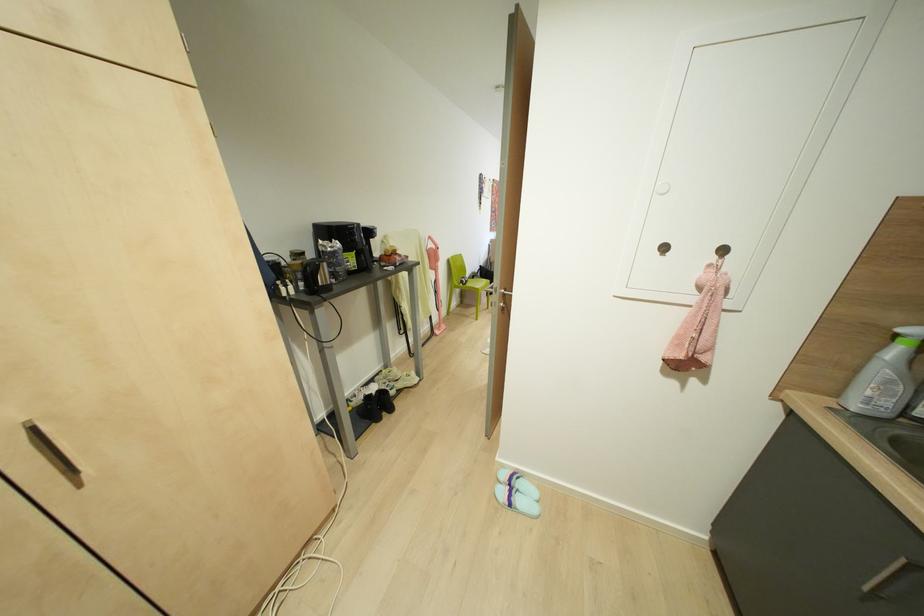
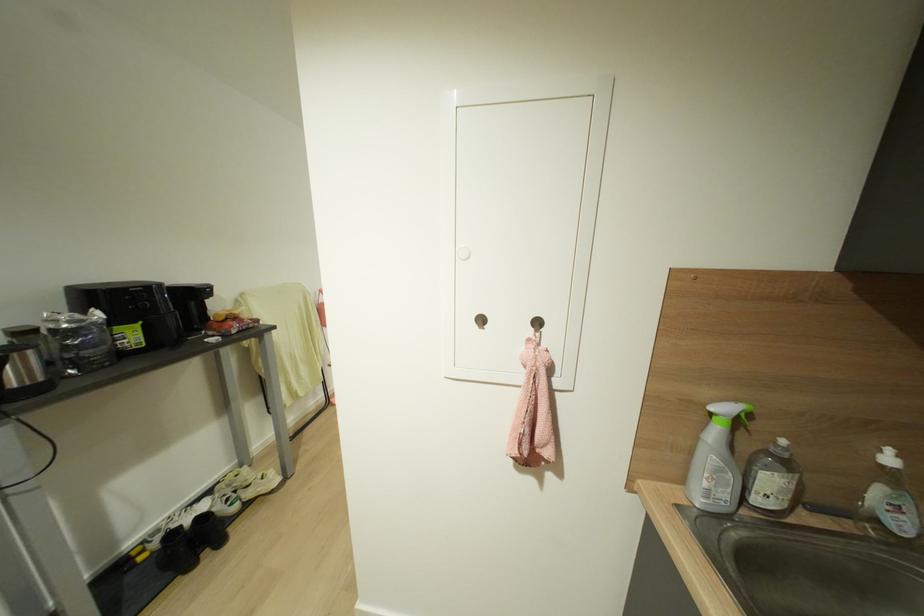
The point at (895,334) is marked in the first image. Where is the corresponding point in the second image?

(711, 411)